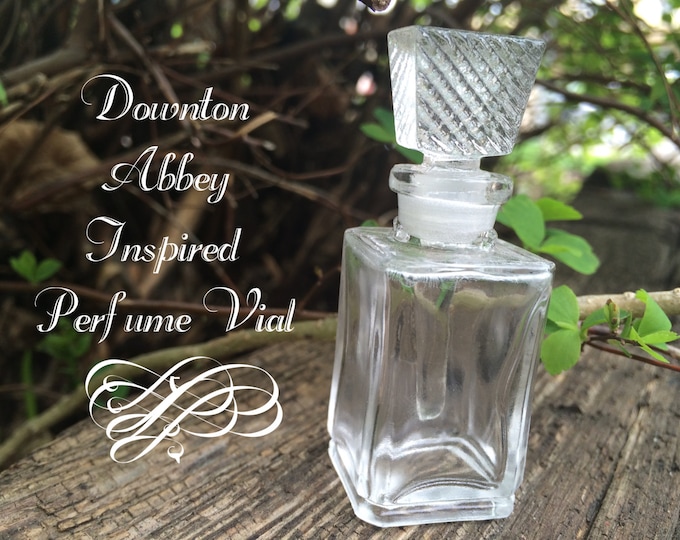
This screenshot has width=680, height=540. I want to click on surface, so click(248, 490).